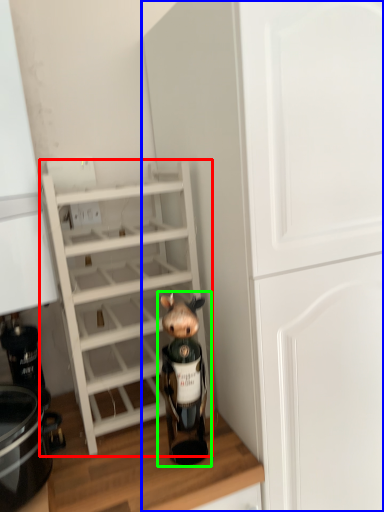
Question: Which object is positioned farthest from shelf (highlighted by a red box)? Select from cabinetry (highlighted by a blue box) and figurine (highlighted by a green box).

Choices:
 (A) cabinetry
 (B) figurine

Answer: (A)